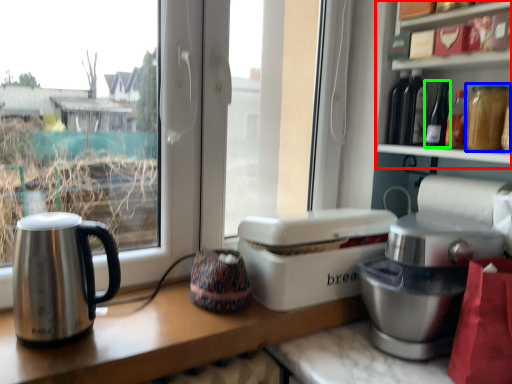
Question: Which is nearer to the shelf (highlighted by a red box)? bottle (highlighted by a blue box) or bottle (highlighted by a green box).

Choices:
 (A) bottle
 (B) bottle

Answer: (B)